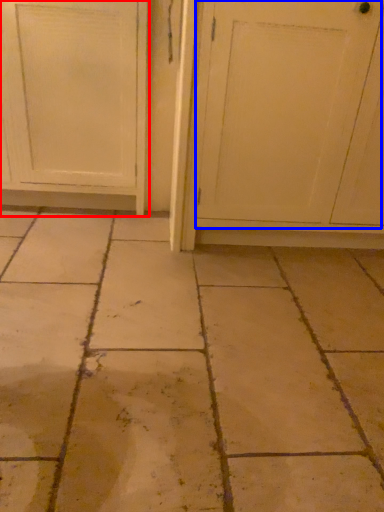
Question: Which point is further to the camera, door (highlighted by a red box) or screen door (highlighted by a blue box)?

Choices:
 (A) door
 (B) screen door

Answer: (A)